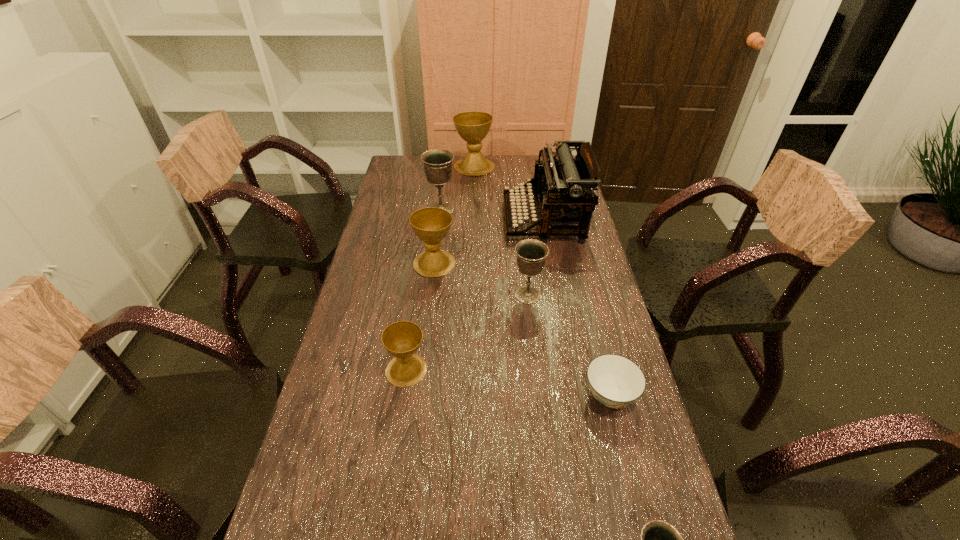
This screenshot has width=960, height=540. In order to click on the nearest brown chalice in this screenshot , I will do `click(401, 339)`.

Where is `the fifth farthest chalice`? the fifth farthest chalice is located at coordinates (401, 339).

Where is `soup bowl`? soup bowl is located at coordinates (615, 381).

The width and height of the screenshot is (960, 540). Identify the location of vacant point located 0.180m on the typing side of the typewriter. (457, 220).

Locate an element on the screen. This screenshot has height=540, width=960. blank space located on the typing side of the typewriter is located at coordinates (472, 220).

At what (x,y) coordinates should I click in order to perform the action: click on vacant space situated on the typing side of the typewriter. Please return your answer as a coordinate pair (x, y). The width and height of the screenshot is (960, 540). Looking at the image, I should click on (483, 220).

I want to click on vacant space located 0.060m on the left of the farthest object, so click(441, 167).

What are the coordinates of `vacant space located 0.070m on the back of the fifth nearest chalice` in the screenshot? It's located at coord(444,192).

At what (x,y) coordinates should I click in order to perform the action: click on free space located 0.380m on the back of the fourth farthest object. Please return your answer as a coordinate pair (x, y). This screenshot has width=960, height=540. Looking at the image, I should click on [443, 192].

The width and height of the screenshot is (960, 540). I want to click on vacant space located on the left of the fourth nearest object, so click(x=383, y=295).